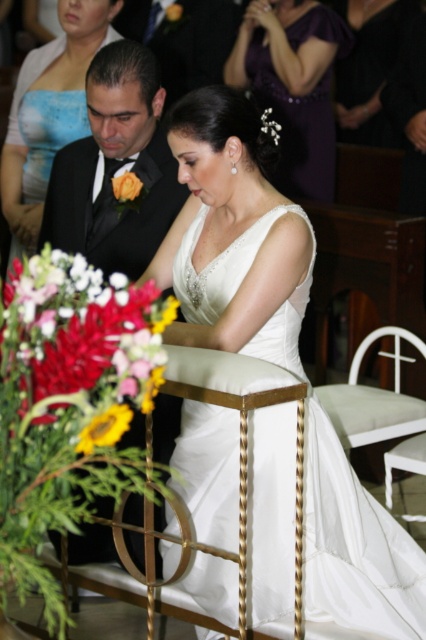
Question: Which point is closer to the camera?

Choices:
 (A) (350, 22)
 (B) (267, 109)
 (C) (106, 433)

Answer: (C)

Question: Does matte black suit at upper left appear on the right side of matte gold boutonniere at upper left?

Choices:
 (A) yes
 (B) no

Answer: (A)

Question: From the image, what is the correct spatial relationship of yellow matte sunflower at lower left in relation to matte gold boutonniere at upper left?

Choices:
 (A) right
 (B) left

Answer: (A)

Question: Which of the following is the closest to the observer?

Choices:
 (A) (2, 355)
 (B) (114, 150)
 (C) (423, 356)
 (D) (167, 8)

Answer: (A)

Question: Estimate the real-world distances between objects in this image. Which object is closer to the white fabric chair at center?

Choices:
 (A) white fabric chair at lower center
 (B) matte black dress at center
 (C) purple satin dress at upper center

Answer: (A)

Question: Observing the image, what is the correct spatial positioning of purple satin dress at upper center in reference to white matte flower at upper center?

Choices:
 (A) left
 (B) right

Answer: (B)